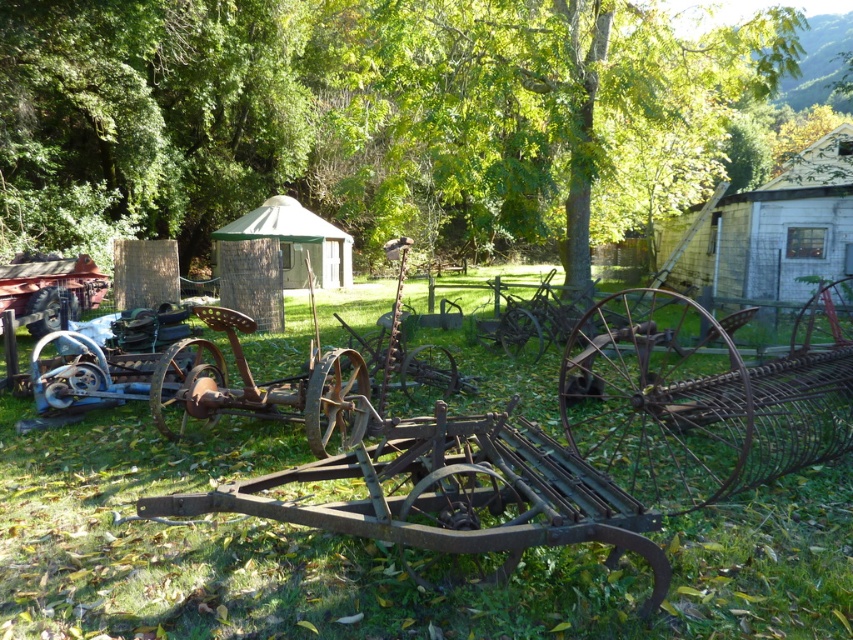
You are a GUI agent. You are given a task and a screenshot of the screen. Output one action in this format:
    pyautogui.click(x=<x>, y=<y>)
    Task: Click on the white brick hut at upper right
    The width and height of the screenshot is (853, 640).
    Given the screenshot: What is the action you would take?
    pyautogui.click(x=769, y=234)

Is white brick hut at upper right taller than green canvas tent at center?

Yes, white brick hut at upper right is taller than green canvas tent at center.

The width and height of the screenshot is (853, 640). In order to click on white brick hut at upper right in this screenshot , I will do `click(769, 234)`.

In order to click on white brick hut at upper right in this screenshot , I will do coord(769,234).

Locate an element on the screen. green leafy tree at center is located at coordinates click(527, 116).

Is point (639, 13) in front of point (840, 296)?

No, it is not.

The width and height of the screenshot is (853, 640). Identify the location of green leafy tree at center. (527, 116).

This screenshot has width=853, height=640. I want to click on green leafy tree at center, so click(527, 116).

Between green leafy tree at center and rusty metal wagon at center, which one is positioned higher?

green leafy tree at center is above.

Where is `green leafy tree at center`? green leafy tree at center is located at coordinates (527, 116).